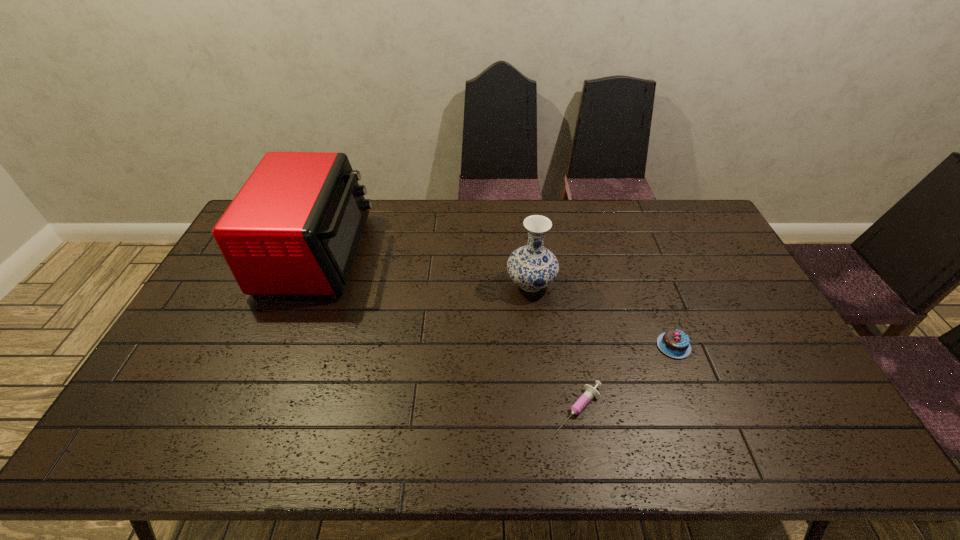
Locate an element on the screen. The image size is (960, 540). free area in between the leftmost object and the syringe is located at coordinates (448, 332).

You are a GUI agent. You are given a task and a screenshot of the screen. Output one action in this format:
    pyautogui.click(x=<x>, y=<y>)
    Task: Click on the vacant space in between the vase and the toaster oven
    The image size is (960, 540).
    Given the screenshot: What is the action you would take?
    pyautogui.click(x=424, y=269)

Locate an element on the screen. This screenshot has width=960, height=540. unoccupied area between the leftmost object and the vase is located at coordinates (424, 269).

The width and height of the screenshot is (960, 540). I want to click on unoccupied position between the second nearest object and the nearest object, so click(626, 377).

Locate an element on the screen. The image size is (960, 540). vacant space that is in between the vase and the shortest object is located at coordinates (555, 346).

Where is `blank region between the nearest object and the toaster oven`? This screenshot has width=960, height=540. blank region between the nearest object and the toaster oven is located at coordinates (448, 332).

The width and height of the screenshot is (960, 540). Find the location of `vacant area between the second nearest object and the toaster oven`. vacant area between the second nearest object and the toaster oven is located at coordinates (495, 300).

The width and height of the screenshot is (960, 540). I want to click on vacant region between the vase and the toaster oven, so click(424, 269).

Locate an element on the screen. This screenshot has height=540, width=960. free space that is in between the toaster oven and the second shortest object is located at coordinates (495, 300).

Image resolution: width=960 pixels, height=540 pixels. I want to click on vacant space that's between the third farthest object and the nearest object, so click(x=626, y=377).